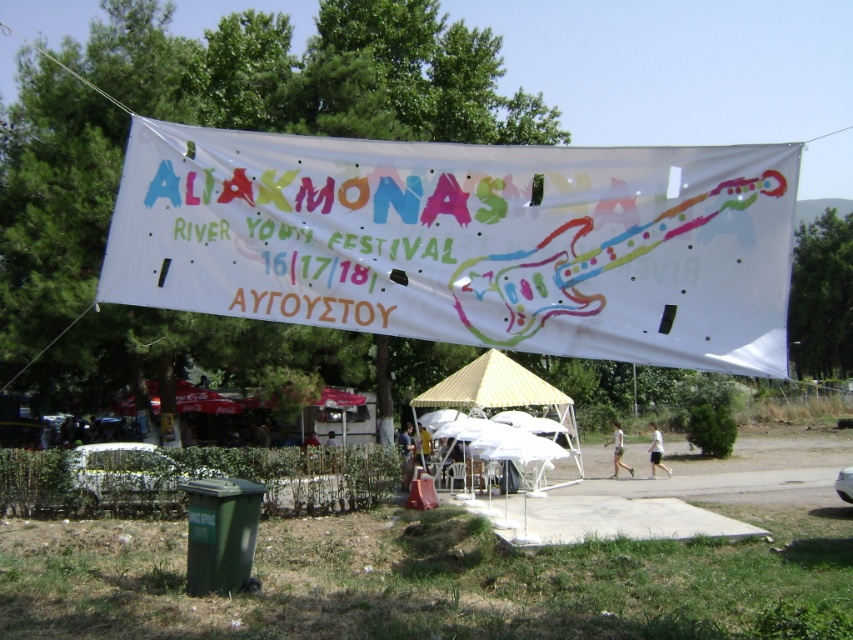
Image resolution: width=853 pixels, height=640 pixels. What do you see at coordinates (466, 241) in the screenshot? I see `white fabric canopy at center` at bounding box center [466, 241].

Does white fabric canopy at center have a greater width compared to white cotton shorts at lower center?

Yes, white fabric canopy at center is wider than white cotton shorts at lower center.

Is point (718, 196) in front of point (618, 432)?

Yes, it is in front of point (618, 432).

At what (x,y) coordinates should I click in order to perform the action: click on white fabric canopy at center. Please return your answer as a coordinate pair (x, y). Image resolution: width=853 pixels, height=640 pixels. Looking at the image, I should click on (466, 241).

Can you confirm if white fabric canopy at center is positioned below white cotton shirt at center?

Incorrect, white fabric canopy at center is not positioned below white cotton shirt at center.

Is point (585, 227) more distant than point (650, 422)?

No, it is in front of (650, 422).

Describe the element at coordinates (466, 241) in the screenshot. This screenshot has height=640, width=853. I see `white fabric canopy at center` at that location.

Identify the location of white fabric canopy at center. Image resolution: width=853 pixels, height=640 pixels. (466, 241).

Is white cotton shirt at center to the left of white cotton shorts at lower center from the viewer's perspective?

In fact, white cotton shirt at center is to the right of white cotton shorts at lower center.

Is white cotton shirt at center behind white cotton shorts at lower center?

No, white cotton shirt at center is in front of white cotton shorts at lower center.

Is point (654, 448) positioned before point (610, 440)?

Yes, point (654, 448) is in front of point (610, 440).

I want to click on white cotton shirt at center, so click(x=656, y=451).